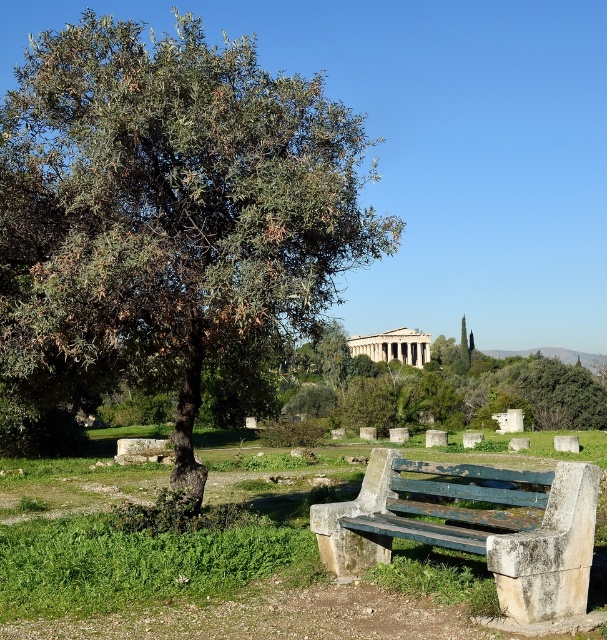
Looking at this image, you are standing at the classical temple in the background and want to walk towards the two points marked in the image. Which point would you reach first, point (510, 556) or point (438, 372)?

Point (510, 556) is in front of point (438, 372), so you would reach point (510, 556) first.

You are standing at the point marked as point (168, 211) in the image. What object are you currently standing on?

You are standing on the green leafy olive tree at upper left.